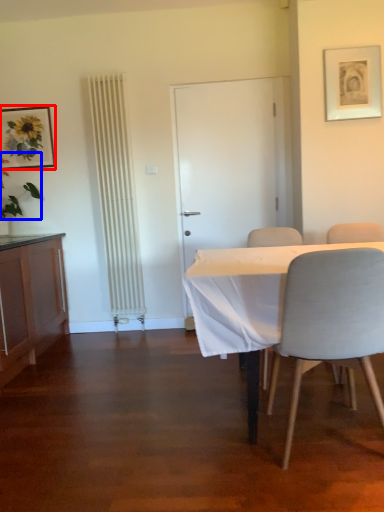
Question: Which of the following is the closest to the observer, picture frame (highlighted by a red box) or plant (highlighted by a blue box)?

Choices:
 (A) picture frame
 (B) plant

Answer: (B)